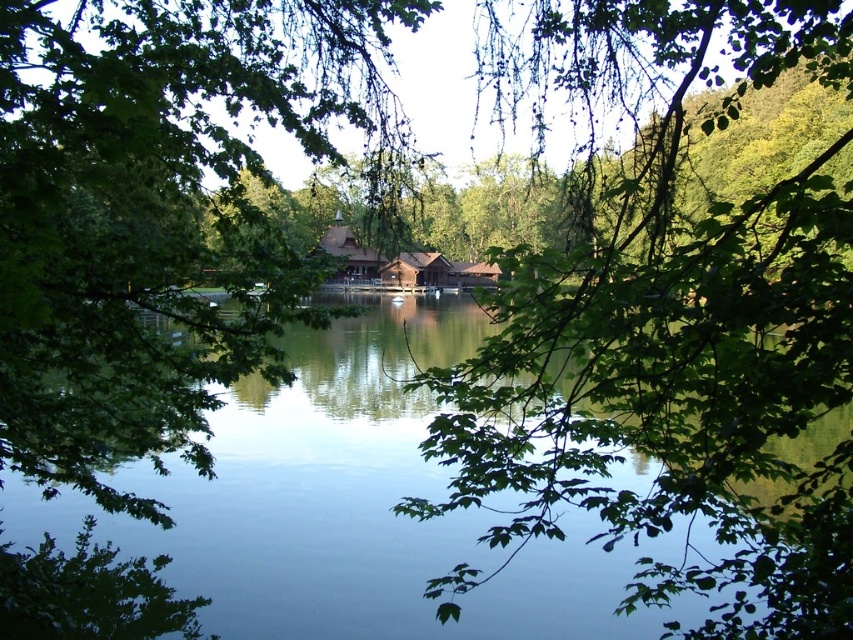
Which is more to the right, green leafy branch at center or transparent water at center?

From the viewer's perspective, green leafy branch at center appears more on the right side.

Is green leafy branch at center positioned in front of transparent water at center?

That is True.

The height and width of the screenshot is (640, 853). Describe the element at coordinates (680, 348) in the screenshot. I see `green leafy branch at center` at that location.

Locate an element on the screen. This screenshot has width=853, height=640. green leafy branch at center is located at coordinates [680, 348].

Does green leafy branch at center have a lesser width compared to green leafy tree at center?

Yes, green leafy branch at center is thinner than green leafy tree at center.

Locate an element on the screen. green leafy branch at center is located at coordinates (680, 348).

You are a GUI agent. You are given a task and a screenshot of the screen. Output one action in this format:
    pyautogui.click(x=<x>, y=<y>)
    Task: Click on the green leafy branch at center
    This screenshot has height=640, width=853.
    Given the screenshot: What is the action you would take?
    pyautogui.click(x=680, y=348)

Does transparent water at center appear under brown wooden cabin at center?

Yes.

Does point (293, 593) lie behind point (456, 280)?

No.

Between point (550, 628) and point (338, 244), which one is positioned behind?

The point (338, 244) is behind.

Identify the location of transparent water at center. (354, 506).